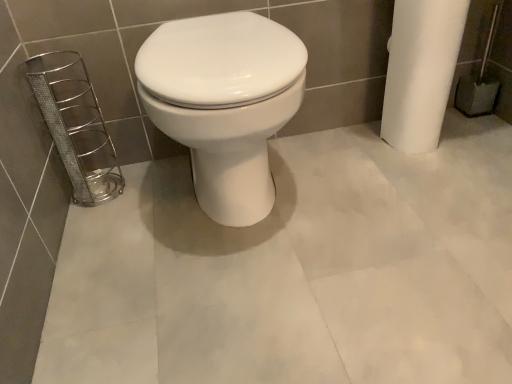
At what (x,y) coordinates should I click in order to perform the action: click on white glossy toilet at center. Please return your answer as a coordinate pair (x, y). Looking at the image, I should click on (224, 103).

Describe the element at coordinates (224, 103) in the screenshot. I see `white glossy toilet at center` at that location.

Locate an element on the screen. The width and height of the screenshot is (512, 384). white glossy toilet at center is located at coordinates (224, 103).